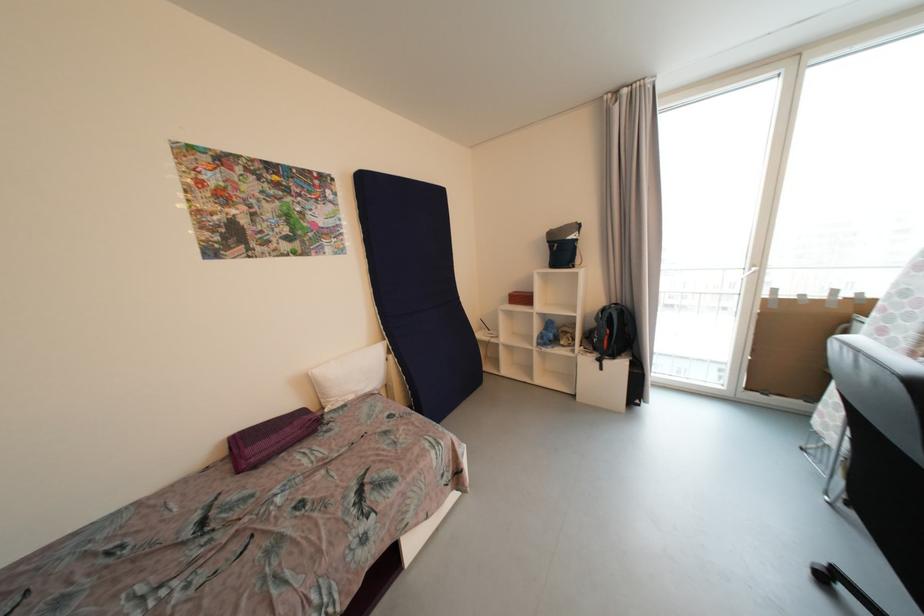
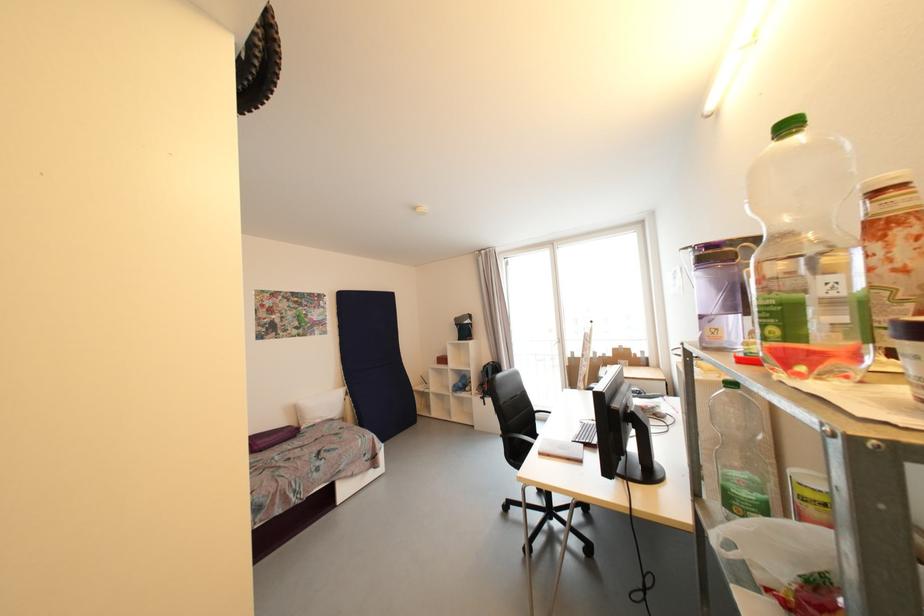
Question: I am providing you with two images of the same scene from different viewpoints. After the viewpoint changes to image2, which objects are now occluded?

Choices:
 (A) empty glass jar
 (B) clear plastic bottle
 (C) red board eraser
 (D) cardboard box

Answer: (D)